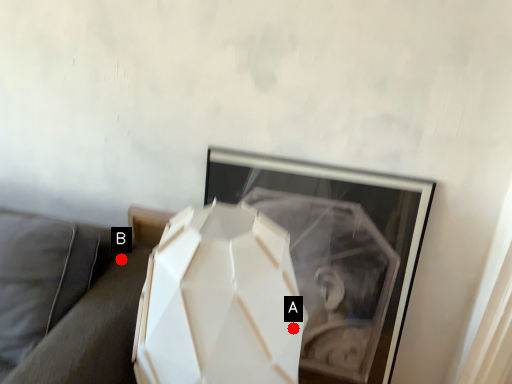
Question: Two points are circled on the image, labeled by A and B beside each circle. Which of the following is the farthest from the observer?

Choices:
 (A) A is further
 (B) B is further

Answer: (B)